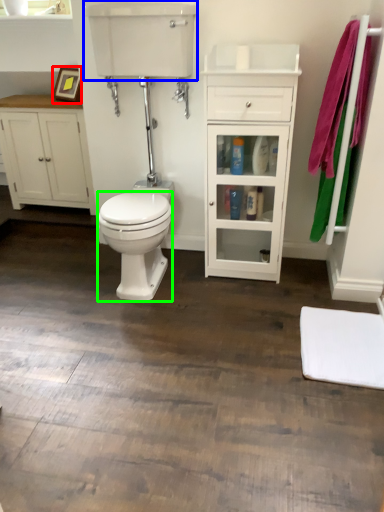
Question: Which is farther away from picture frame (highlighted by a red box)? sink (highlighted by a blue box) or bidet (highlighted by a green box)?

Choices:
 (A) sink
 (B) bidet

Answer: (B)